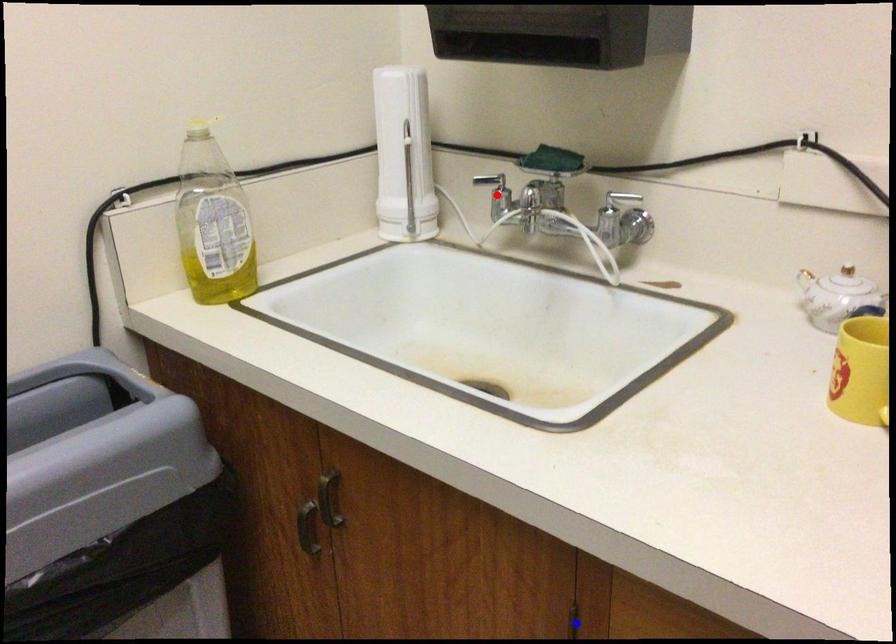
Question: Which of the two points in the image is closer to the camera?

Choices:
 (A) Blue point is closer.
 (B) Red point is closer.

Answer: (A)